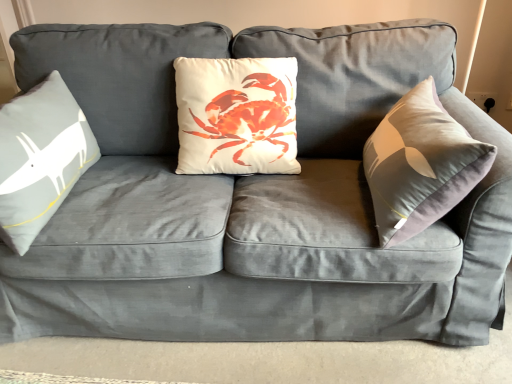
Find the location of a particular element. Image resolution: width=512 pixels, height=384 pixels. white matte pillow at left is located at coordinates (40, 158).

Describe the element at coordinates (40, 158) in the screenshot. I see `white matte pillow at left` at that location.

What are the coordinates of `white matte pillow at left` in the screenshot? It's located at pos(40,158).